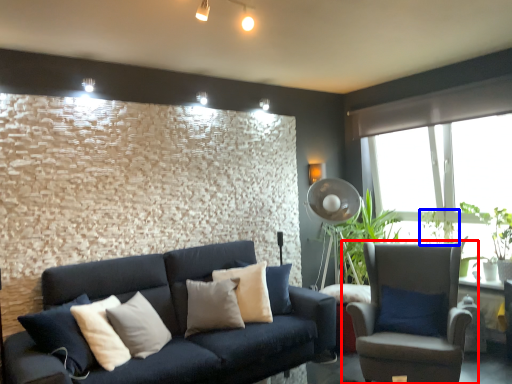
Question: Which object is further to the camera taking this photo, chair (highlighted by a red box) or plant (highlighted by a blue box)?

Choices:
 (A) chair
 (B) plant

Answer: (B)